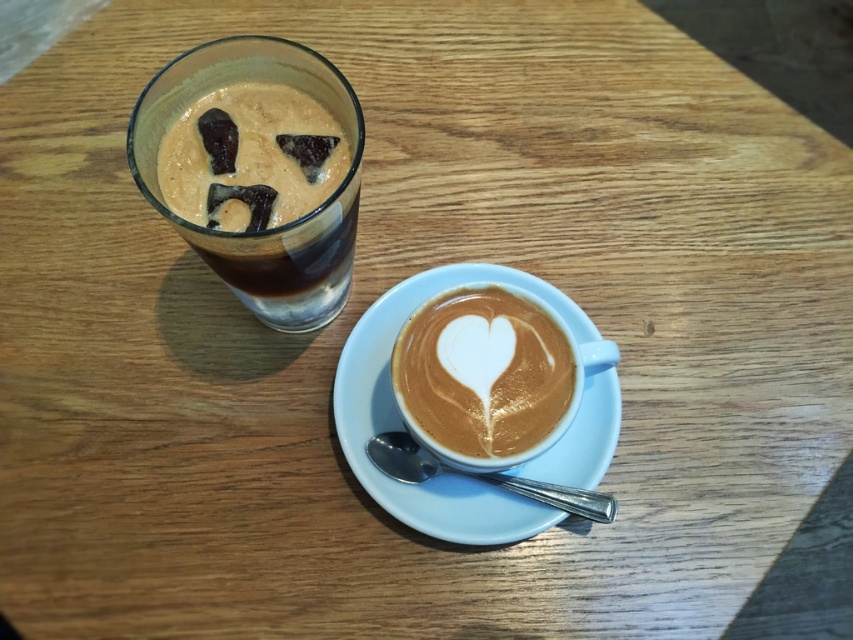
Is white ceramic saucer at center thinner than white frothy latte art at center?

No.

Who is taller, white ceramic saucer at center or white frothy latte art at center?

Standing taller between the two is white ceramic saucer at center.

Which is behind, point (548, 284) or point (398, 344)?

Point (548, 284)

Locate an element on the screen. The image size is (853, 640). white ceramic saucer at center is located at coordinates (401, 420).

Which is behind, point (151, 77) or point (456, 342)?

The point (151, 77) is behind.

Is matte brown glass at upper left smaller than white frothy latte art at center?

No, matte brown glass at upper left is not smaller than white frothy latte art at center.

Describe the element at coordinates (265, 228) in the screenshot. I see `matte brown glass at upper left` at that location.

Where is `matte brown glass at upper left`? Image resolution: width=853 pixels, height=640 pixels. matte brown glass at upper left is located at coordinates (265, 228).

Which is in front, point (397, 307) or point (136, 129)?

Positioned in front is point (136, 129).

Which is more to the left, white ceramic saucer at center or matte brown glass at upper left?

matte brown glass at upper left is more to the left.

Between point (440, 276) and point (195, 241), which one is positioned in front?

Point (195, 241)

You are a GUI agent. You are given a task and a screenshot of the screen. Output one action in this format:
    pyautogui.click(x=<x>, y=<y>)
    Task: Click on the white ceramic saucer at center
    This screenshot has height=640, width=853.
    Given the screenshot: What is the action you would take?
    pyautogui.click(x=401, y=420)